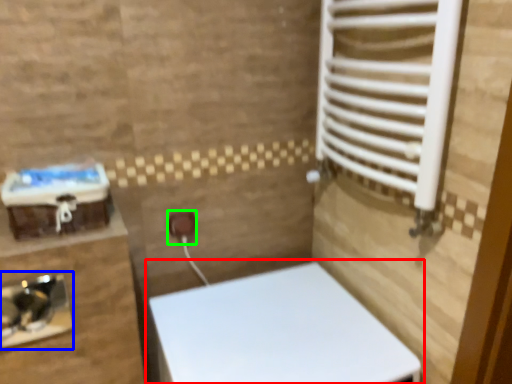
Question: Based on their relative distances, which object is nearer to toilet (highlighted by a red box)? Choose from sink (highlighted by a blue box) and electric outlet (highlighted by a green box).

Choices:
 (A) sink
 (B) electric outlet

Answer: (B)